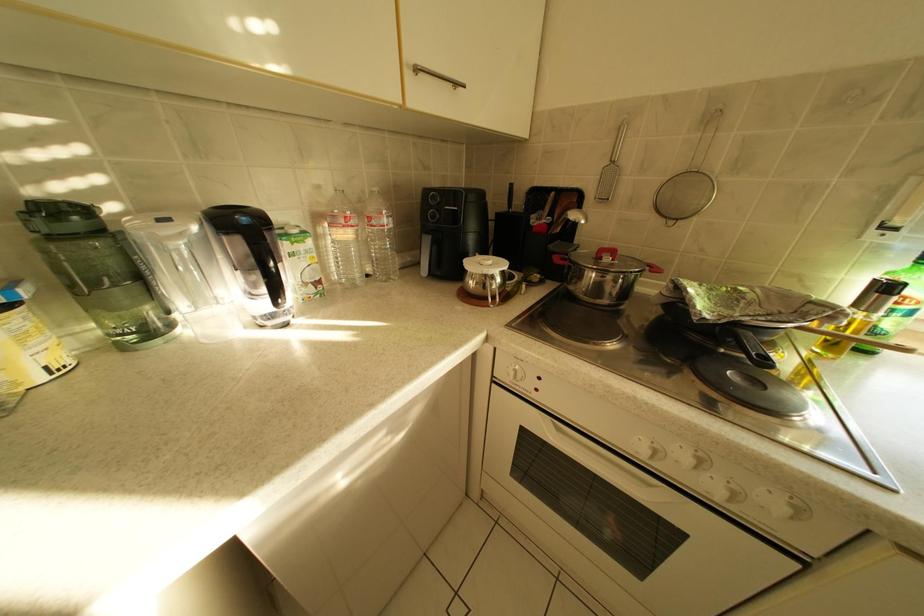
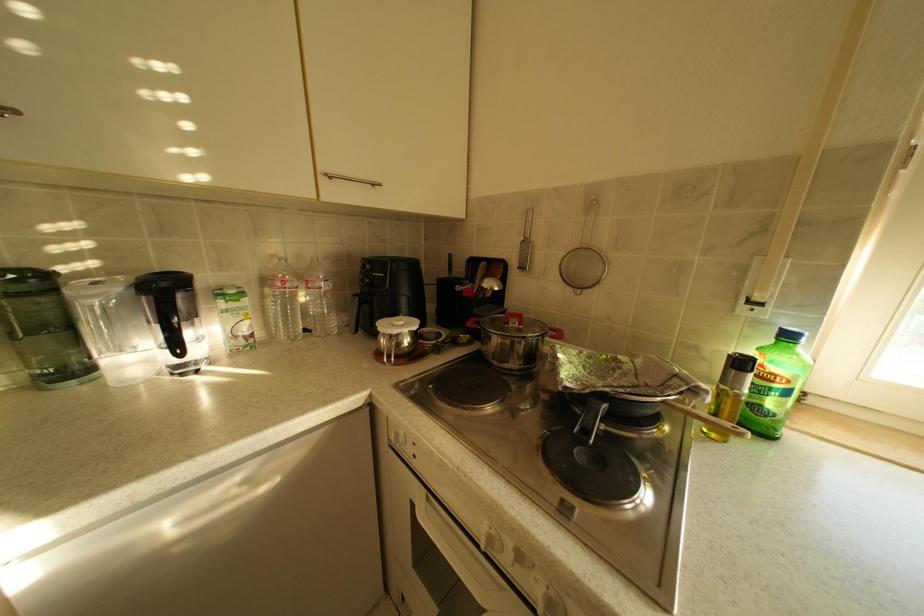
Question: Which direction would the cameraman need to move to produce the second image? Reply with the corresponding letter.

Choices:
 (A) Left
 (B) Right
 (C) Forward
 (D) Backward

Answer: (B)